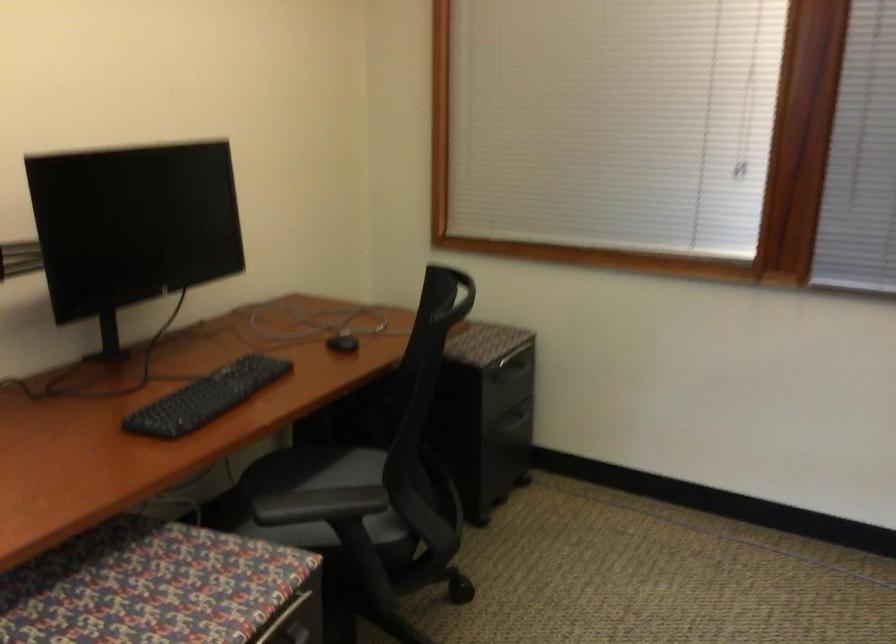
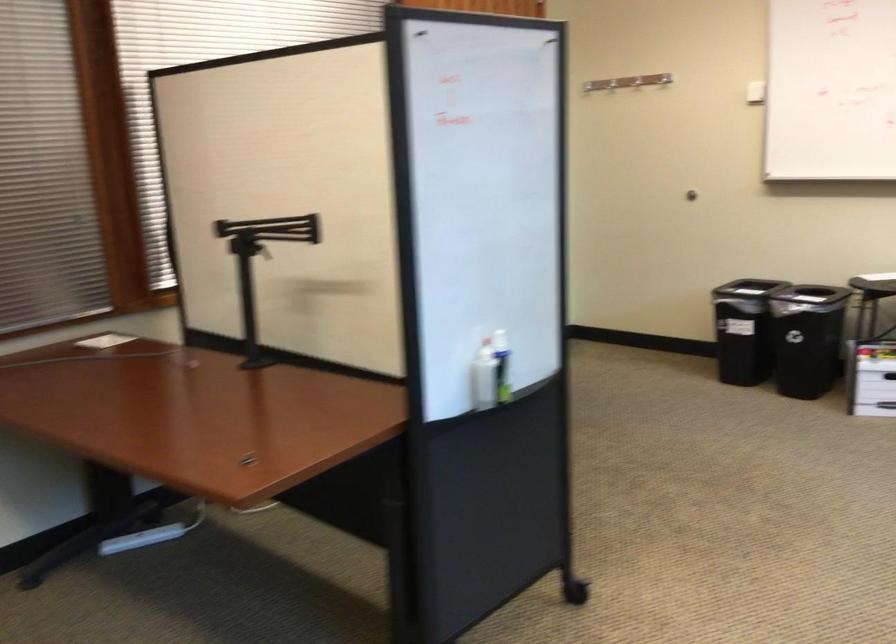
Question: How did the camera likely rotate?

Choices:
 (A) Left
 (B) Right
 (C) Up
 (D) Down

Answer: (B)